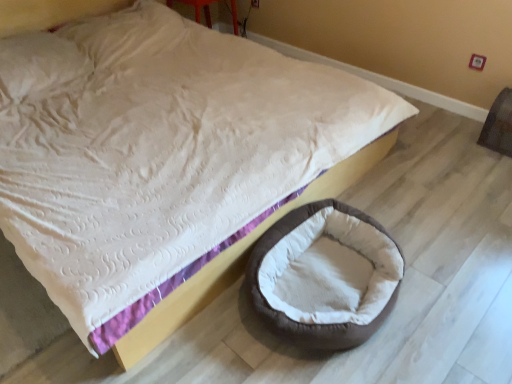
Question: Looking at their shapes, would you say brown fabric bean bag at right is wider or thinner than brown plush dog bed at lower right?

Choices:
 (A) wide
 (B) thin

Answer: (B)

Question: From a real-world perspective, is brown fabric bean bag at right physically located above or below brown plush dog bed at lower right?

Choices:
 (A) above
 (B) below

Answer: (A)

Question: Looking at the image, does brown fabric bean bag at right seem bigger or smaller compared to brown plush dog bed at lower right?

Choices:
 (A) big
 (B) small

Answer: (B)

Question: From the image's perspective, relative to brown fabric bean bag at right, is brown plush dog bed at lower right above or below?

Choices:
 (A) above
 (B) below

Answer: (B)

Question: Considering the relative positions of brown plush dog bed at lower right and brown fabric bean bag at right in the image provided, is brown plush dog bed at lower right to the left or to the right of brown fabric bean bag at right?

Choices:
 (A) right
 (B) left

Answer: (B)

Question: Looking at their shapes, would you say brown plush dog bed at lower right is wider or thinner than brown fabric bean bag at right?

Choices:
 (A) wide
 (B) thin

Answer: (A)

Question: In the image, is brown plush dog bed at lower right positioned in front of or behind brown fabric bean bag at right?

Choices:
 (A) behind
 (B) front

Answer: (B)